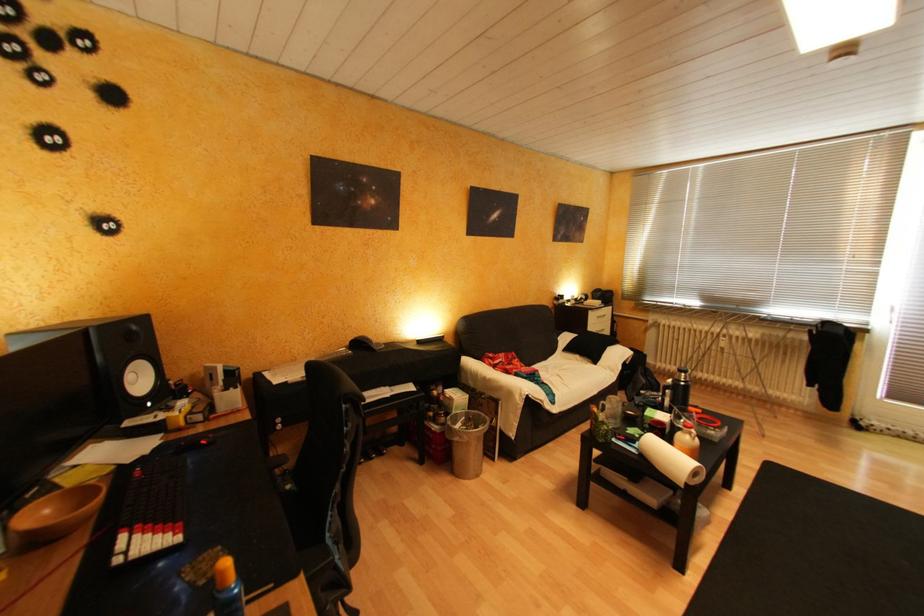
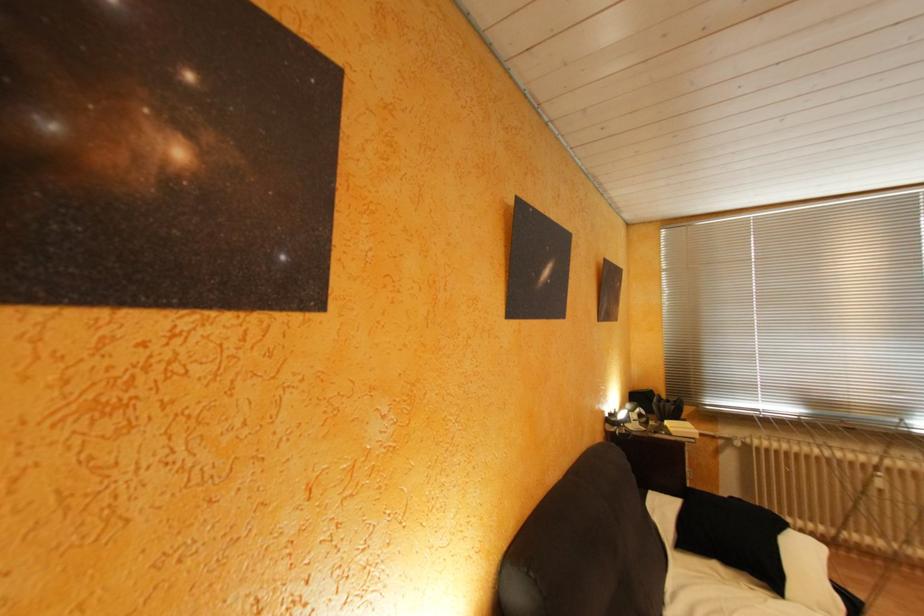
Question: In a continuous first-person perspective shot, in which direction is the camera moving?

Choices:
 (A) Left
 (B) Right
 (C) Forward
 (D) Backward

Answer: (C)